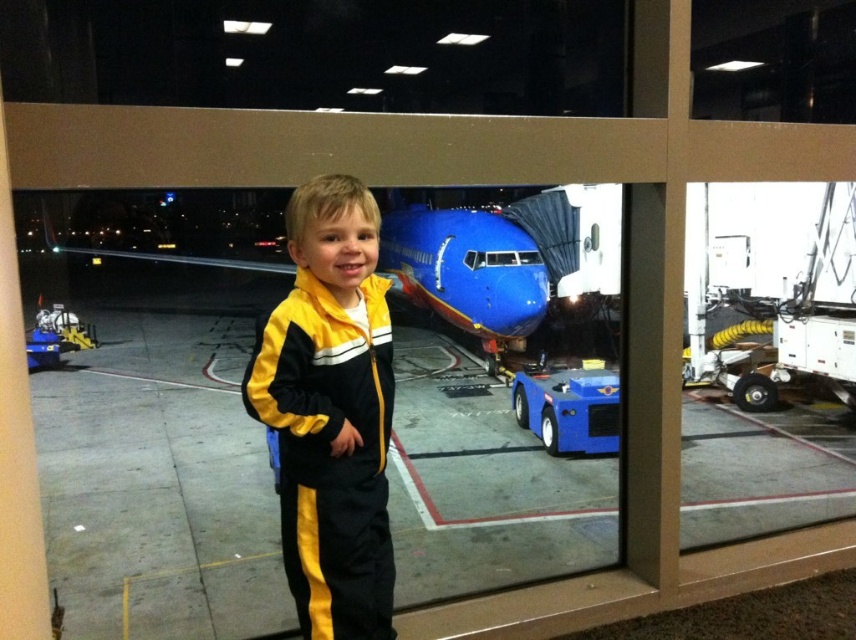
Question: Is brushed metal tarmac at center smaller than yellow/black track suit at center?

Choices:
 (A) yes
 (B) no

Answer: (B)

Question: Which point is farther to the camera?

Choices:
 (A) blue glossy airplane at center
 (B) yellow/black track suit at center
 (C) brushed metal tarmac at center

Answer: (A)

Question: Is brushed metal tarmac at center positioned in front of blue plastic toy car at center?

Choices:
 (A) yes
 (B) no

Answer: (A)

Question: Which object is farther from the camera taking this photo?

Choices:
 (A) yellow/black track suit at center
 (B) blue plastic toy car at center
 (C) blue glossy airplane at center
 (D) brushed metal tarmac at center

Answer: (B)

Question: Which point appears farthest from the camera in this image?

Choices:
 (A) (704, 480)
 (B) (524, 310)
 (C) (587, 380)
 (D) (327, 211)

Answer: (B)

Question: Can you confirm if brushed metal tarmac at center is positioned below blue plastic toy car at center?

Choices:
 (A) yes
 (B) no

Answer: (B)